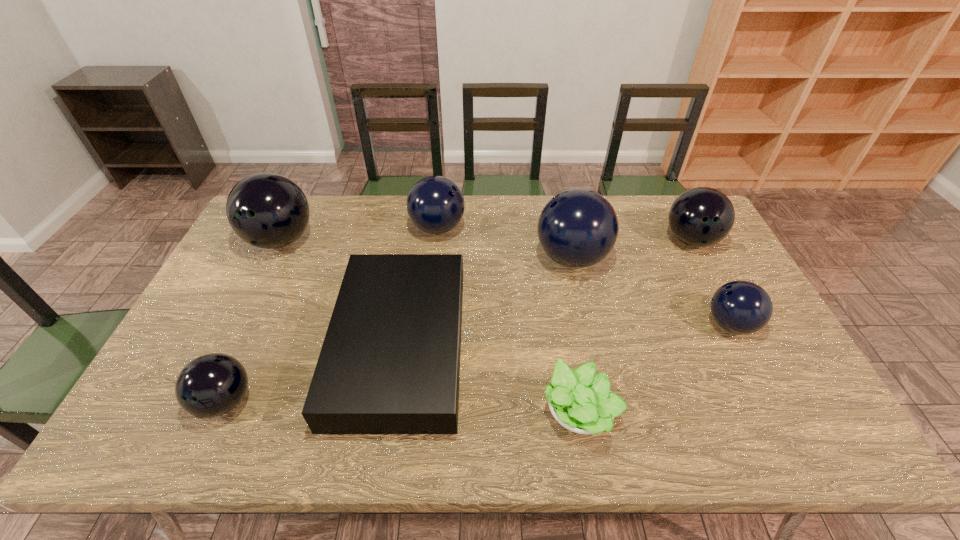
Locate an element on the screen. black bowling ball identified as the second closest to the biggest black bowling ball is located at coordinates (703, 216).

Identify the location of vacant space that satisfies the following two spatial constraints: 1. on the side of the rightmost black bowling ball with the finger holes; 2. at the front of the CD player for disc insertion. The width and height of the screenshot is (960, 540). point(746,346).

I want to click on vacant space that satisfies the following two spatial constraints: 1. at the front of the CD player for disc insertion; 2. on the left side of the lettuce, so pos(390,411).

At what (x,y) coordinates should I click in order to perform the action: click on vacant position in the image that satisfies the following two spatial constraints: 1. at the front of the CD player for disc insertion; 2. on the back side of the lettuce. Please return your answer as a coordinate pair (x, y). This screenshot has width=960, height=540. Looking at the image, I should click on (390, 411).

The height and width of the screenshot is (540, 960). What are the coordinates of `vacant space that satisfies the following two spatial constraints: 1. on the surface of the green lettuce near the finger holes; 2. on the right side of the leftmost blue bowling ball` in the screenshot? It's located at (418, 411).

Where is `vacant space that satisfies the following two spatial constraints: 1. on the side of the rightmost black bowling ball with the finger holes; 2. on the surface of the nearest blue bowling ball near the finger holes`? vacant space that satisfies the following two spatial constraints: 1. on the side of the rightmost black bowling ball with the finger holes; 2. on the surface of the nearest blue bowling ball near the finger holes is located at coordinates (734, 325).

Image resolution: width=960 pixels, height=540 pixels. What are the coordinates of `vacant space that satisfies the following two spatial constraints: 1. on the surface of the fourth bowling ball from left to right near the finger holes; 2. on the front side of the lettuce` in the screenshot? It's located at (605, 411).

Locate an element on the screen. The width and height of the screenshot is (960, 540). free space that satisfies the following two spatial constraints: 1. on the surface of the rightmost blue bowling ball near the finger holes; 2. on the side of the nearest black bowling ball with the finger holes is located at coordinates (770, 401).

Where is `free region that satisfies the following two spatial constraints: 1. on the side of the biggest black bowling ball with the finger holes; 2. on the left side of the lettuce`? This screenshot has height=540, width=960. free region that satisfies the following two spatial constraints: 1. on the side of the biggest black bowling ball with the finger holes; 2. on the left side of the lettuce is located at coordinates (197, 411).